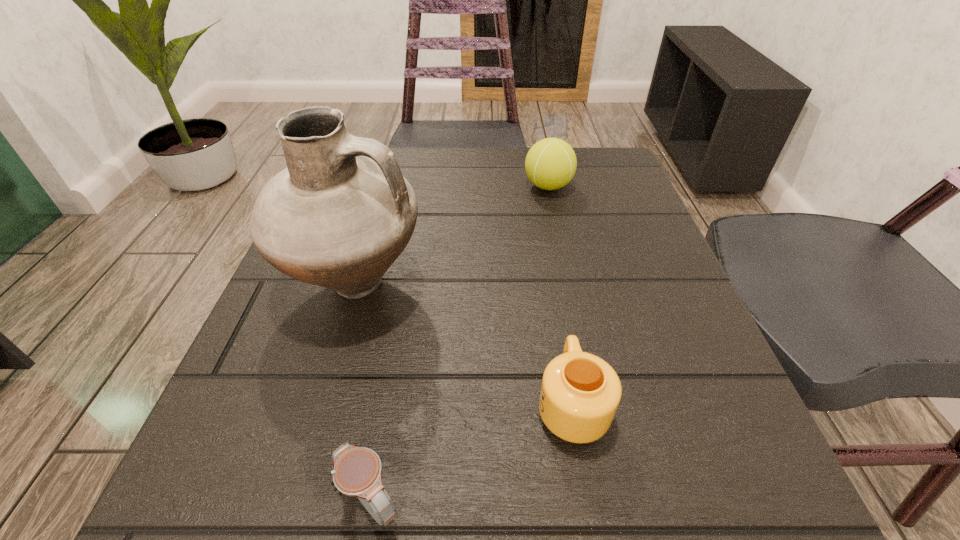
Find the location of a particular element. vacant space situated on the handle side of the mug is located at coordinates (542, 232).

You are a GUI agent. You are given a task and a screenshot of the screen. Output one action in this format:
    pyautogui.click(x=<x>, y=<y>)
    Task: Click on the vacant space located 0.310m on the right of the watch
    This screenshot has height=540, width=960.
    Given the screenshot: What is the action you would take?
    pyautogui.click(x=693, y=502)

Identify the location of object at the far edge. (550, 164).

Locate an element on the screen. This screenshot has width=960, height=540. object positioned at the near edge is located at coordinates (357, 471).

Find the location of a particular element. object positioned at the left edge is located at coordinates (338, 216).

Locate an element on the screen. The height and width of the screenshot is (540, 960). object at the right edge is located at coordinates (550, 164).

I want to click on object located in the far right corner section of the desktop, so click(x=550, y=164).

You are a GUI agent. You are given a task and a screenshot of the screen. Output one action in this format:
    pyautogui.click(x=<x>, y=<y>)
    Task: Click on the vacant position at the far edge of the desktop
    The width and height of the screenshot is (960, 540).
    Given the screenshot: What is the action you would take?
    pyautogui.click(x=501, y=146)

This screenshot has height=540, width=960. I want to click on free location at the near edge, so tap(387, 488).

The height and width of the screenshot is (540, 960). Identify the location of free location at the left edge. (323, 312).